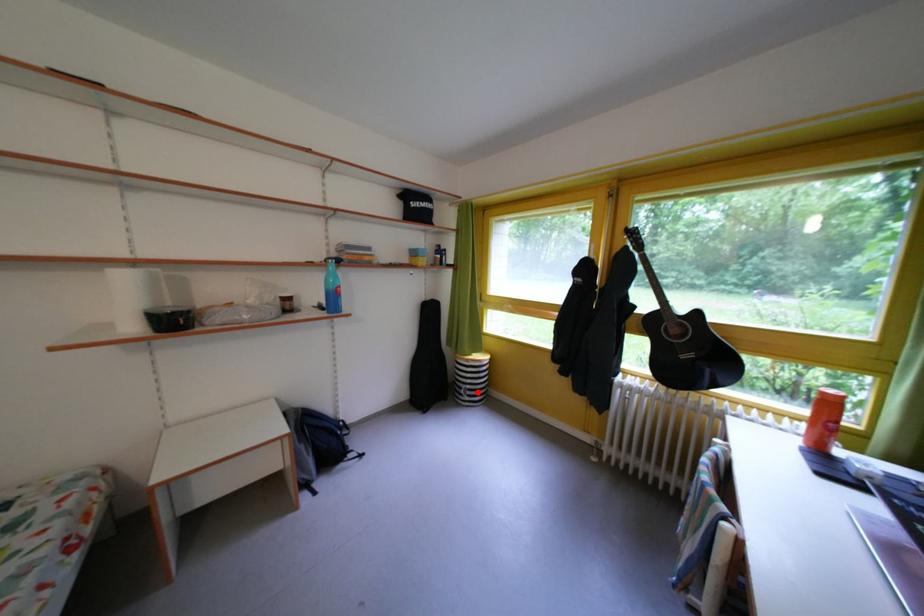
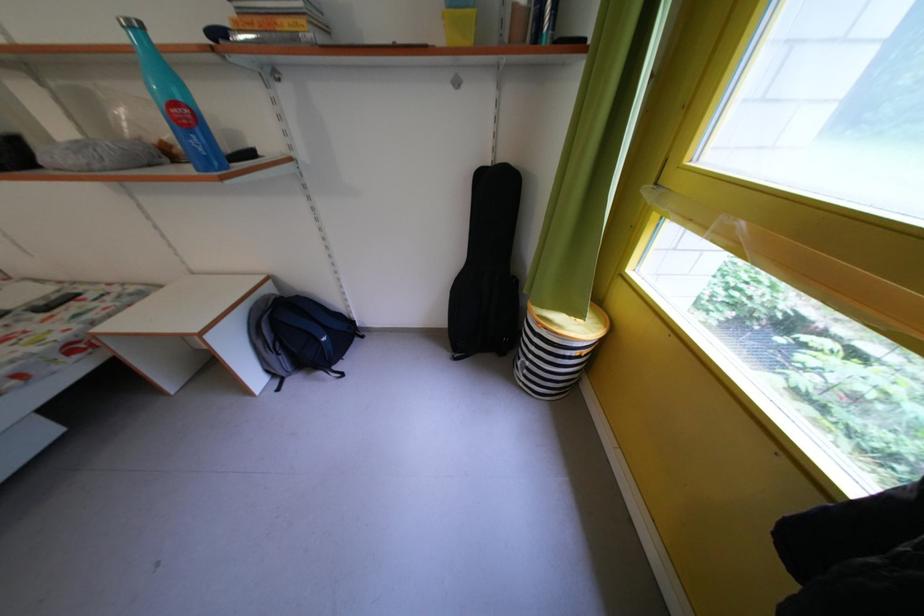
Question: I am providing you with two images of the same scene from different viewpoints. A red point is shown in image1. For the corresponding object point in image2, is it positioned nearer or farther from the camera?

Choices:
 (A) Nearer
 (B) Farther

Answer: (A)